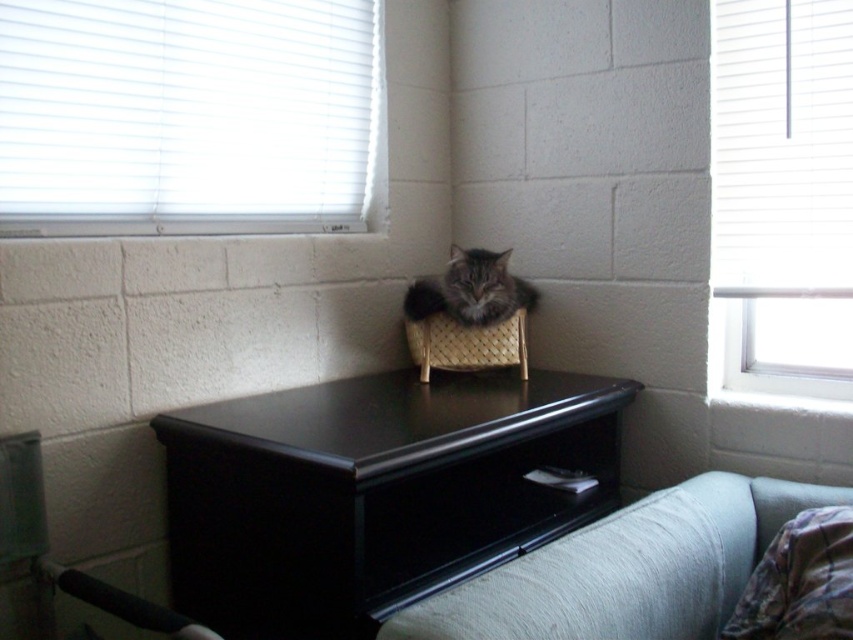
You are organizing the desk and need to know which object takes up more desk space. Based on the scene, which one is larger in size between the white blinds at upper right and the black wood drawer at lower center?

The black wood drawer at lower center is larger in size because the white blinds at upper right occupies less space than it.